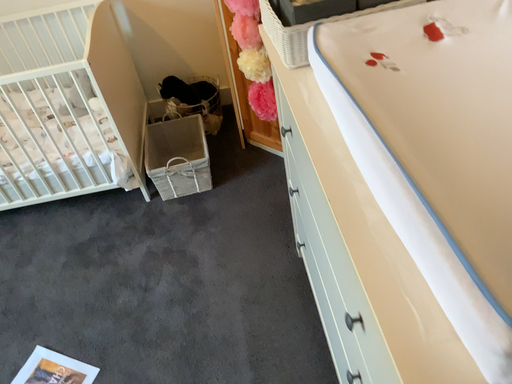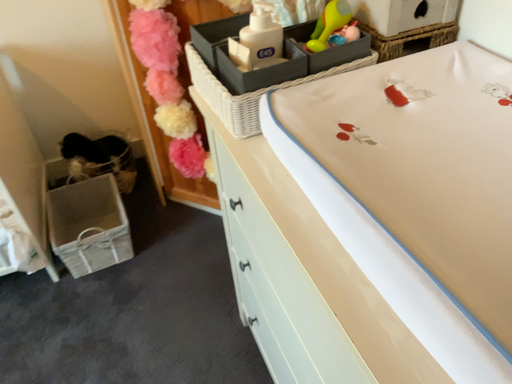
Question: Which way did the camera rotate in the video?

Choices:
 (A) rotated right
 (B) rotated left

Answer: (A)